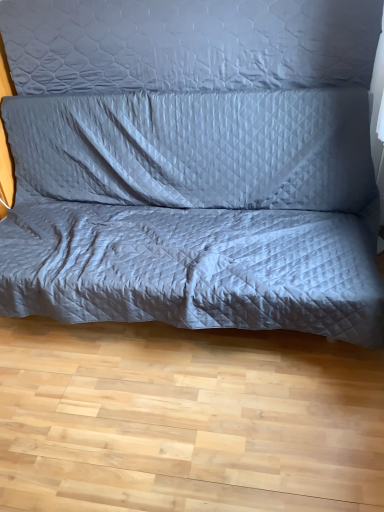
Describe the element at coordinates (188, 44) in the screenshot. I see `gray quilted pillow at upper center` at that location.

The width and height of the screenshot is (384, 512). In order to click on gray quilted pillow at upper center in this screenshot , I will do `click(188, 44)`.

This screenshot has width=384, height=512. I want to click on quilted fabric couch at center, so click(x=193, y=165).

What do you see at coordinates (193, 165) in the screenshot? The height and width of the screenshot is (512, 384). I see `quilted fabric couch at center` at bounding box center [193, 165].

Identify the location of gray quilted pillow at upper center. (188, 44).

Is gray quilted pillow at upper center at the right side of quilted fabric couch at center?

Yes, gray quilted pillow at upper center is to the right of quilted fabric couch at center.

Which object is closer to the camera taking this photo, gray quilted pillow at upper center or quilted fabric couch at center?

Positioned in front is quilted fabric couch at center.

Which point is more forward, (66, 76) or (240, 50)?

Point (240, 50)

From the image's perspective, relative to quilted fabric couch at center, is gray quilted pillow at upper center above or below?

From the image's perspective, gray quilted pillow at upper center appears above quilted fabric couch at center.

Based on the photo, from a real-world perspective, is gray quilted pillow at upper center on quilted fabric couch at center?

Yes.

Which of these two, gray quilted pillow at upper center or quilted fabric couch at center, is wider?

quilted fabric couch at center.

Considering the relative sizes of gray quilted pillow at upper center and quilted fabric couch at center in the image provided, is gray quilted pillow at upper center taller than quilted fabric couch at center?

No, gray quilted pillow at upper center is not taller than quilted fabric couch at center.

Between gray quilted pillow at upper center and quilted fabric couch at center, which one has smaller size?

gray quilted pillow at upper center is smaller.

Can we say gray quilted pillow at upper center lies outside quilted fabric couch at center?

Yes.

Is gray quilted pillow at upper center not close to quilted fabric couch at center?

gray quilted pillow at upper center is near quilted fabric couch at center, not far away.

Is gray quilted pillow at upper center facing away from quilted fabric couch at center?

No, gray quilted pillow at upper center is not facing away from quilted fabric couch at center.

How many degrees apart are the facing directions of gray quilted pillow at upper center and quilted fabric couch at center?

The angle between the facing direction of gray quilted pillow at upper center and the facing direction of quilted fabric couch at center is 0.723 degrees.

Where is `pillow that appears above the quilted fabric couch at center (from the image's perspective)`? The height and width of the screenshot is (512, 384). pillow that appears above the quilted fabric couch at center (from the image's perspective) is located at coordinates (188, 44).

Can you confirm if quilted fabric couch at center is positioned to the left of gray quilted pillow at upper center?

Correct, you'll find quilted fabric couch at center to the left of gray quilted pillow at upper center.

Which object is more forward, quilted fabric couch at center or gray quilted pillow at upper center?

quilted fabric couch at center.

Based on the photo, which point is more distant from viewer, (20, 289) or (30, 45)?

Positioned behind is point (30, 45).

From the image's perspective, is quilted fabric couch at center above gray quilted pillow at upper center?

Incorrect, from the image's perspective, quilted fabric couch at center is lower than gray quilted pillow at upper center.

From a real-world perspective, is quilted fabric couch at center located beneath gray quilted pillow at upper center?

Correct, in the physical world, quilted fabric couch at center is lower than gray quilted pillow at upper center.

Is quilted fabric couch at center wider than gray quilted pillow at upper center?

Correct, the width of quilted fabric couch at center exceeds that of gray quilted pillow at upper center.

Is quilted fabric couch at center taller than gray quilted pillow at upper center?

Yes, quilted fabric couch at center is taller than gray quilted pillow at upper center.

Which of these two, quilted fabric couch at center or gray quilted pillow at upper center, is bigger?

quilted fabric couch at center.

Is quilted fabric couch at center surrounding gray quilted pillow at upper center?

No, gray quilted pillow at upper center is located outside of quilted fabric couch at center.

Is quilted fabric couch at center with gray quilted pillow at upper center?

quilted fabric couch at center is not next to gray quilted pillow at upper center, and they're not touching.

Is quilted fabric couch at center facing towards gray quilted pillow at upper center?

No, quilted fabric couch at center is not turned towards gray quilted pillow at upper center.

Can you tell me how much quilted fabric couch at center and gray quilted pillow at upper center differ in facing direction?

The facing directions of quilted fabric couch at center and gray quilted pillow at upper center are 0.723 degrees apart.

The image size is (384, 512). I want to click on pillow lying on the right of quilted fabric couch at center, so click(188, 44).

Locate an element on the screen. The width and height of the screenshot is (384, 512). pillow located above the quilted fabric couch at center (from the image's perspective) is located at coordinates (188, 44).

Identify the location of studio couch directly beneath the gray quilted pillow at upper center (from a real-world perspective). The image size is (384, 512). (193, 165).